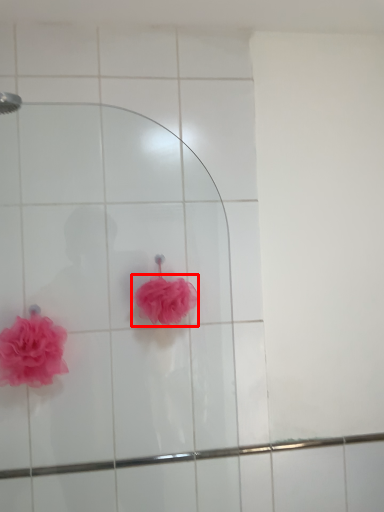
Question: Observing the image, what is the correct spatial positioning of flower (annotated by the red box) in reference to flower?

Choices:
 (A) left
 (B) right

Answer: (B)